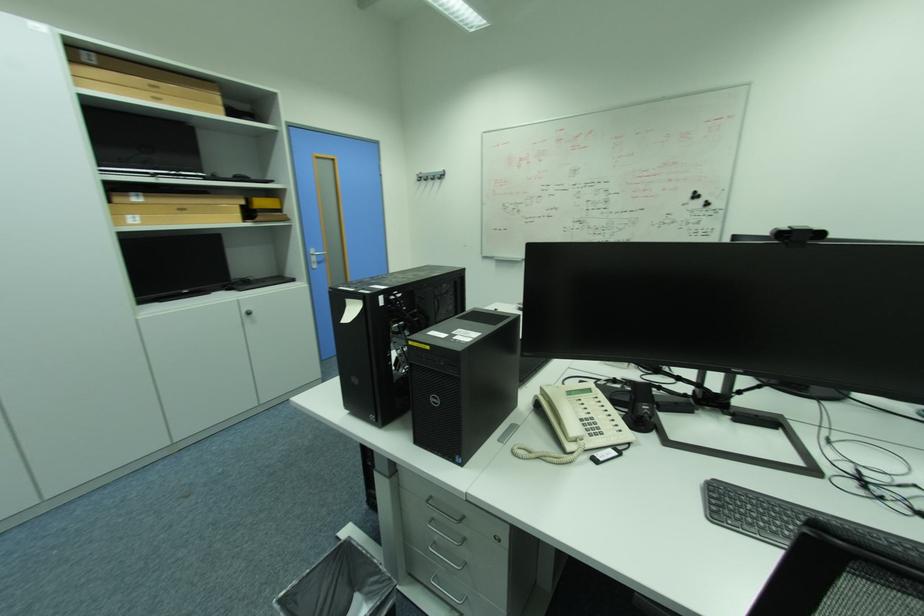
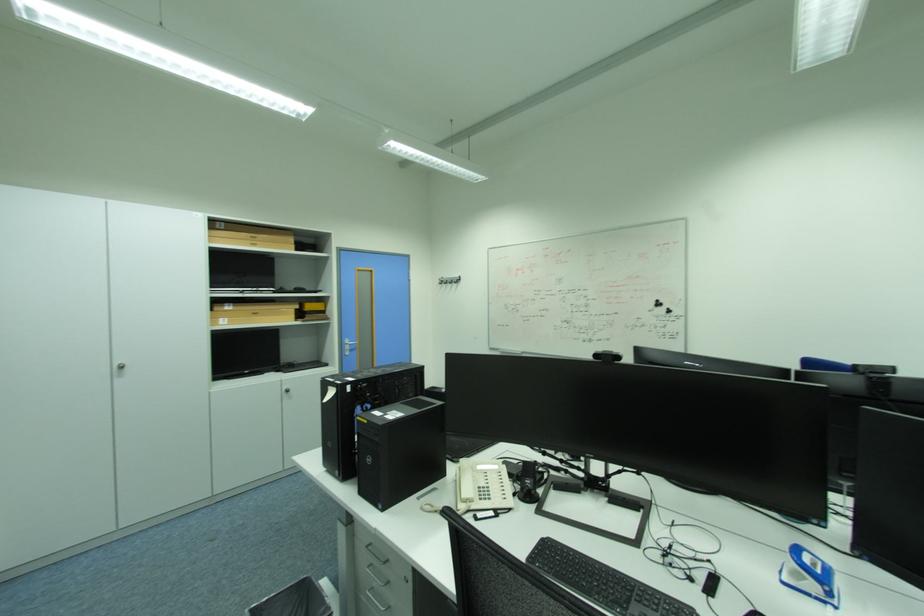
In the second image, find the point that corresponds to point (161, 100) in the first image.

(261, 246)